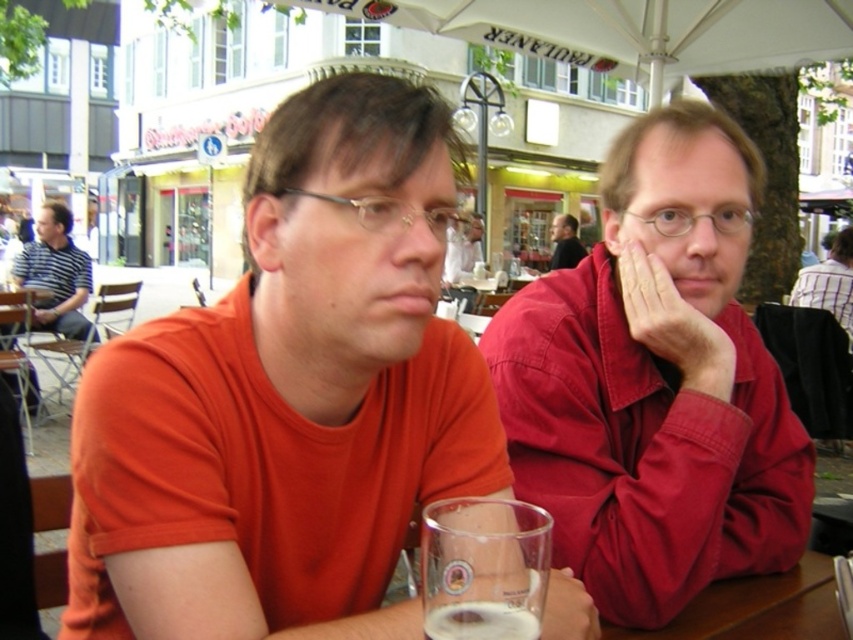
Can you confirm if orange t-shirt at left is taller than clear glass beer at lower center?

Indeed, orange t-shirt at left has a greater height compared to clear glass beer at lower center.

Can you confirm if orange t-shirt at left is smaller than clear glass beer at lower center?

Actually, orange t-shirt at left might be larger than clear glass beer at lower center.

Where is `orange t-shirt at left`? The height and width of the screenshot is (640, 853). orange t-shirt at left is located at coordinates (289, 396).

The height and width of the screenshot is (640, 853). What are the coordinates of `orange t-shirt at left` in the screenshot? It's located at (289, 396).

Is foamy glass at lower center further to the viewer compared to matte red shirt at center?

No, foamy glass at lower center is in front of matte red shirt at center.

Where is `foamy glass at lower center`? foamy glass at lower center is located at coordinates (480, 621).

Who is taller, translucent glass at lower center or matte red shirt at center?

With more height is matte red shirt at center.

What do you see at coordinates (567, 609) in the screenshot? I see `translucent glass at lower center` at bounding box center [567, 609].

Does point (572, 602) come farther from viewer compared to point (549, 262)?

No, (572, 602) is closer to viewer.

Locate an element on the screen. The height and width of the screenshot is (640, 853). translucent glass at lower center is located at coordinates (567, 609).